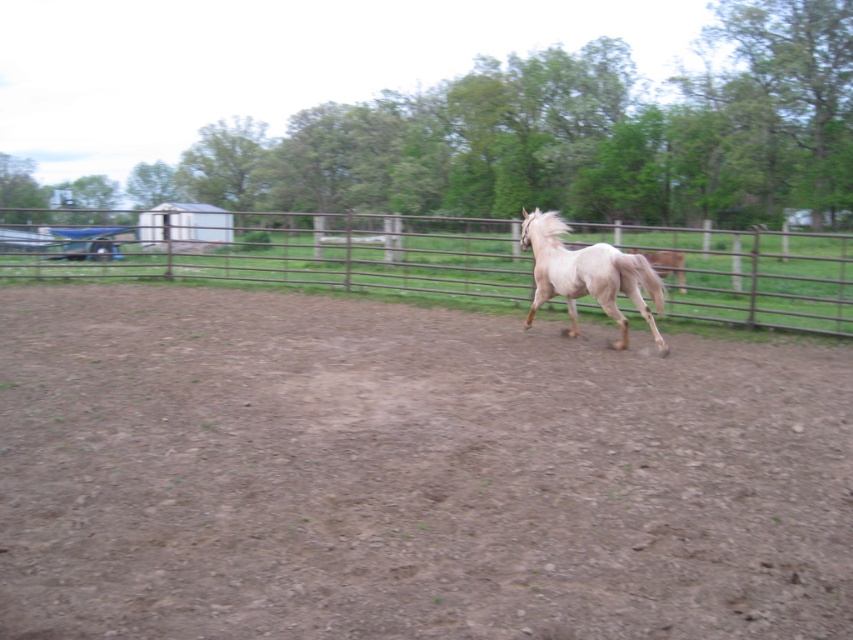
Question: Does brown dirt field at center appear under rusty metal fence at center?

Choices:
 (A) yes
 (B) no

Answer: (A)

Question: Does brown dirt field at center appear on the left side of rusty metal fence at center?

Choices:
 (A) yes
 (B) no

Answer: (A)

Question: Can you confirm if brown dirt field at center is bigger than rusty metal fence at center?

Choices:
 (A) yes
 (B) no

Answer: (B)

Question: Which object appears closest to the camera in this image?

Choices:
 (A) brown dirt field at center
 (B) rusty metal fence at center

Answer: (A)

Question: Which point is closer to the camera taking this photo?

Choices:
 (A) (347, 227)
 (B) (595, 381)
 (C) (561, 259)

Answer: (B)

Question: Which point is closer to the camera?

Choices:
 (A) (253, 620)
 (B) (798, 262)
 (C) (602, 307)

Answer: (A)